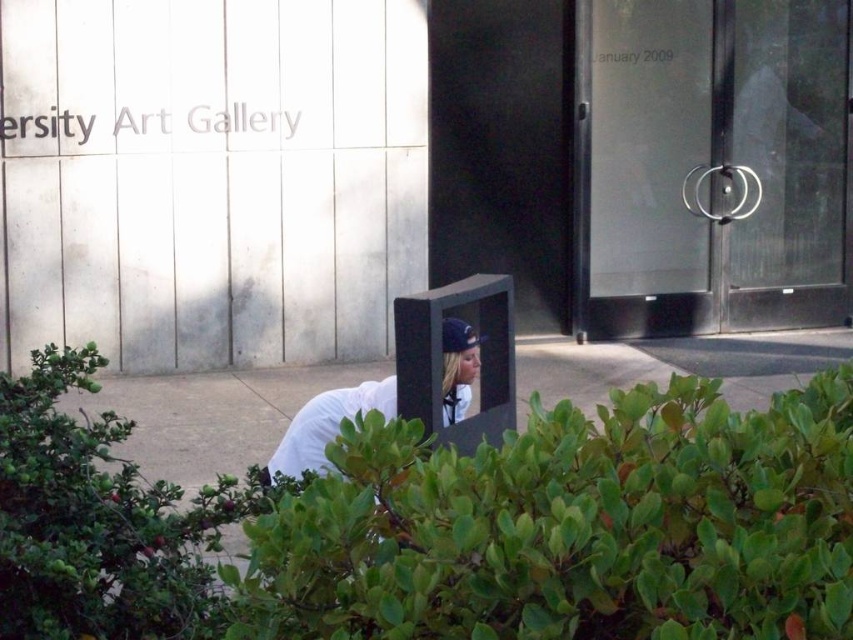
Does transparent glass door at center right have a lesser height compared to white matte shirt at lower center?

No, transparent glass door at center right is not shorter than white matte shirt at lower center.

Which is behind, point (628, 288) or point (462, 369)?

The point (628, 288) is behind.

Locate an element on the screen. The width and height of the screenshot is (853, 640). transparent glass door at center right is located at coordinates (718, 163).

Which is more to the right, green leafy bush at lower center or white matte shirt at lower center?

Positioned to the right is green leafy bush at lower center.

Is point (610, 548) more distant than point (335, 392)?

No, it is in front of (335, 392).

Where is `green leafy bush at lower center`? The width and height of the screenshot is (853, 640). green leafy bush at lower center is located at coordinates (572, 525).

Between green leafy bush at lower left and white matte shirt at lower center, which one appears on the left side from the viewer's perspective?

green leafy bush at lower left

Which is more to the right, green leafy bush at lower left or white matte shirt at lower center?

white matte shirt at lower center

Locate an element on the screen. This screenshot has height=640, width=853. green leafy bush at lower left is located at coordinates (100, 522).